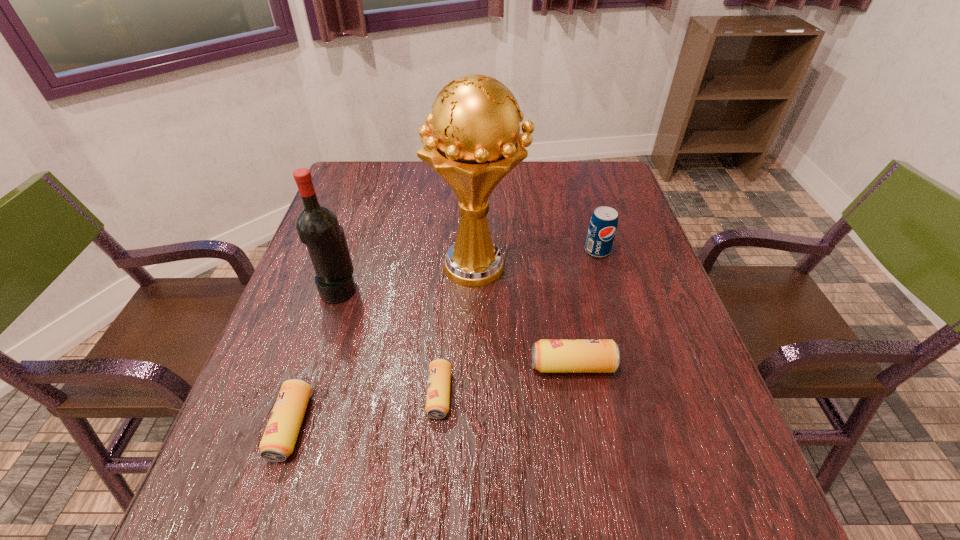
Where is `the leftmost beer can`? The height and width of the screenshot is (540, 960). the leftmost beer can is located at coordinates (278, 441).

This screenshot has height=540, width=960. I want to click on the fifth tallest object, so click(x=278, y=441).

Locate an element on the screen. the shortest object is located at coordinates [438, 390].

You are a GUI agent. You are given a task and a screenshot of the screen. Output one action in this format:
    pyautogui.click(x=<x>, y=<y>)
    Task: Click on the second beer can from left to right
    The height and width of the screenshot is (540, 960).
    Given the screenshot: What is the action you would take?
    pyautogui.click(x=438, y=390)

You are a GUI agent. You are given a task and a screenshot of the screen. Output one action in this format:
    pyautogui.click(x=<x>, y=<y>)
    Task: Click on the fourth tallest object
    
    Given the screenshot: What is the action you would take?
    (548, 355)

Identify the location of the rightmost beer can. (548, 355).

What are the coordinates of `the fourth shortest object` in the screenshot? It's located at (603, 224).

Find the location of a particular element. This screenshot has height=540, width=960. pop is located at coordinates (603, 224).

Identify the location of the tallest object. This screenshot has height=540, width=960. point(475,141).

Image resolution: width=960 pixels, height=540 pixels. Identify the location of wine bottle. (317, 226).